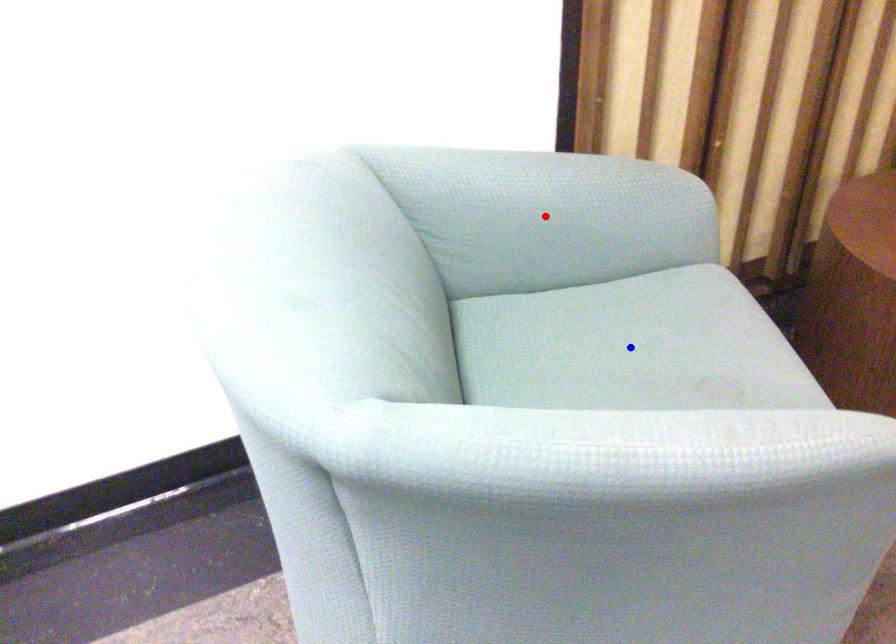
Question: In the image, two points are highlighted. Which point is nearer to the camera? Reply with the corresponding letter.

Choices:
 (A) blue point
 (B) red point

Answer: (A)